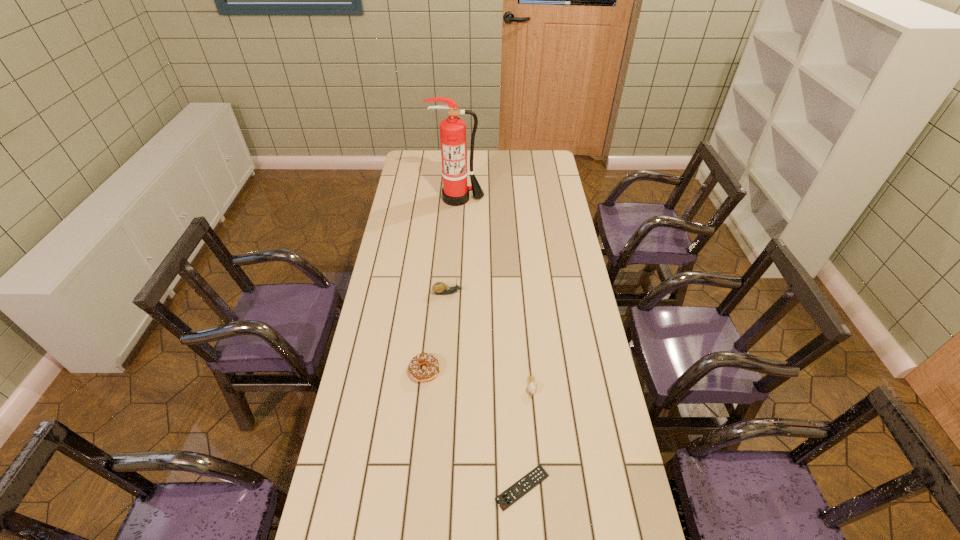
The image size is (960, 540). I want to click on the tallest object, so click(455, 192).

Where is `fire extinguisher`? fire extinguisher is located at coordinates (455, 192).

Find the location of a particular element. the second farthest object is located at coordinates (439, 288).

The image size is (960, 540). I want to click on the left escargot, so click(x=439, y=288).

At what (x,y) coordinates should I click in order to perform the action: click on doughnut. Please return your answer as a coordinate pair (x, y). Image resolution: width=960 pixels, height=540 pixels. Looking at the image, I should click on (421, 375).

This screenshot has height=540, width=960. Find the location of `the second shortest object`. the second shortest object is located at coordinates (532, 387).

Image resolution: width=960 pixels, height=540 pixels. I want to click on the shorter escargot, so click(x=532, y=387).

At what (x,y) coordinates should I click in order to perform the action: click on remote control. Please return your answer as a coordinate pair (x, y). The height and width of the screenshot is (540, 960). Looking at the image, I should click on (507, 498).

Locate an element on the screen. the nearest object is located at coordinates (507, 498).

Find the location of `vacant space situated at the nozzle of the fire extinguisher`. vacant space situated at the nozzle of the fire extinguisher is located at coordinates (454, 264).